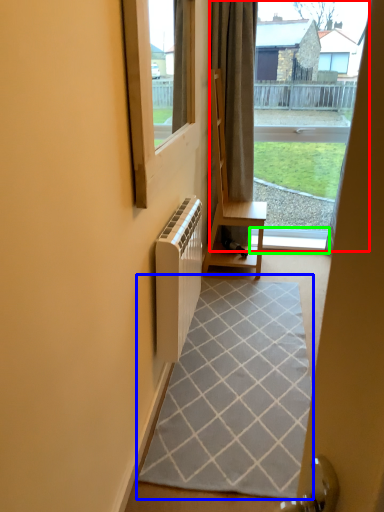
Question: Which object is the farthest from bay window (highlighted by a red box)? Choose among these: doormat (highlighted by a blue box) or window sill (highlighted by a green box).

Choices:
 (A) doormat
 (B) window sill

Answer: (A)